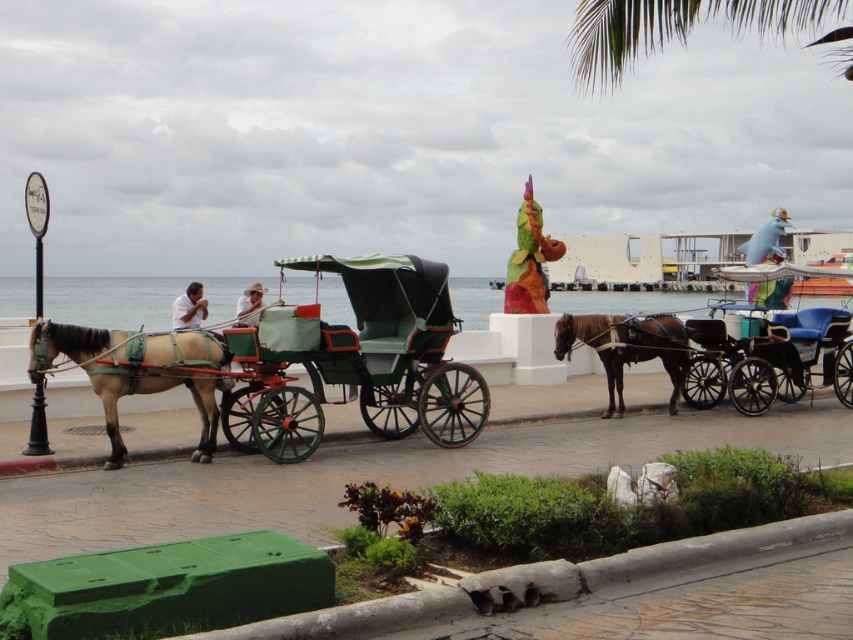
You are a tourist standing in front of the two carriages in the scene. Which of the two carriages, the green painted wood horse cart at center or the matte green coach at center, is positioned lower in the image?

The green painted wood horse cart at center is located below the matte green coach at center, so it is positioned lower in the image.

You are a photographer planning to take a photo of the green painted wood horse cart at center and the blue leather cart at center. Since you want both carts to appear balanced in the frame, which cart should you position closer to the camera to maintain their apparent sizes?

To balance their apparent sizes in the photo, you should position the blue leather cart at center closer to the camera than the green painted wood horse cart at center. Since the green painted wood horse cart at center is larger in size, moving the smaller blue leather cart at center forward will help make them appear similar in size in the photo.

You are a tourist standing in the street scene by the sea and want to take a photo of both the green painted wood horse cart at center and the matte green coach at center. Which one should you position to your left to include both in the frame?

You should position the matte green coach at center to your left because the green painted wood horse cart at center is on its right side, so arranging the matte green coach at center to your left will have the green painted wood horse cart at center naturally to the right in the photo.